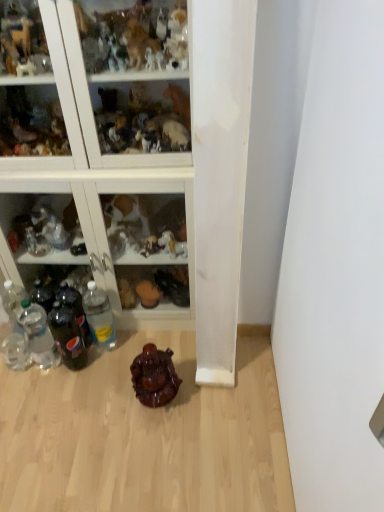
Where is `clear glass bottles at left, the second shelf from the top`? clear glass bottles at left, the second shelf from the top is located at coordinates (102, 215).

Measure the distance between clear plastic bottles at left, the fifth bottle positioned from the right, and camera.

clear plastic bottles at left, the fifth bottle positioned from the right, and camera are 1.62 meters apart.

This screenshot has height=512, width=384. Describe the element at coordinates (16, 347) in the screenshot. I see `clear plastic bottles at left, the fifth bottle positioned from the right` at that location.

What do you see at coordinates (38, 335) in the screenshot? Image resolution: width=384 pixels, height=512 pixels. I see `clear plastic bottles at left, the 4th bottle when ordered from right to left` at bounding box center [38, 335].

I want to click on clear plastic bottles at left, the 4th bottle when ordered from right to left, so click(x=38, y=335).

How much space does clear plastic bottle at lower left, arranged as the first bottle when viewed from the right, occupy horizontally?

2.85 inches.

Based on the photo, what is the approximate width of black plastic bottles at left, which is the 3th bottle from right to left?

black plastic bottles at left, which is the 3th bottle from right to left, is 2.85 inches wide.

Find the location of a particular element. This screenshot has width=384, height=512. translucent glass figurines at upper center, the second shelf positioned from the bottom is located at coordinates (96, 81).

At what (x,y) coordinates should I click in order to perform the action: click on shiny brown statue at center. Please return your answer as a coordinate pair (x, y). The image size is (384, 512). Looking at the image, I should click on (154, 376).

I want to click on clear glass bottles at left, the 1th shelf from the bottom, so click(102, 215).

Can you see translucent glass figurines at upper center, the first shelf positioned from the top, touching clear plastic bottles at left, the 1th bottle from the left?

No, translucent glass figurines at upper center, the first shelf positioned from the top, is not next to clear plastic bottles at left, the 1th bottle from the left.

From a real-world perspective, count 1st bottles downward from the translucent glass figurines at upper center, the second shelf positioned from the bottom, and point to it. Please provide its 2D coordinates.

[(16, 347)]

From the image's perspective, between translucent glass figurines at upper center, the second shelf positioned from the bottom, and clear plastic bottles at left, the 1th bottle from the left, who is located below?

clear plastic bottles at left, the 1th bottle from the left, from the image's perspective.

Considering the relative positions of shiny brown statue at center and clear plastic bottles at left, the fifth bottle positioned from the right, in the image provided, is shiny brown statue at center to the left of clear plastic bottles at left, the fifth bottle positioned from the right, from the viewer's perspective?

In fact, shiny brown statue at center is to the right of clear plastic bottles at left, the fifth bottle positioned from the right.

Could you measure the distance between shiny brown statue at center and clear plastic bottles at left, the fifth bottle positioned from the right?

shiny brown statue at center is 51.84 centimeters from clear plastic bottles at left, the fifth bottle positioned from the right.

Where is `the 2nd bottle above when counting from the shiny brown statue at center (from the image's perspective)`? Image resolution: width=384 pixels, height=512 pixels. the 2nd bottle above when counting from the shiny brown statue at center (from the image's perspective) is located at coordinates (16, 347).

How different are the orientations of shiny brown statue at center and clear plastic bottles at left, the fifth bottle positioned from the right, in degrees?

There is a 10-degree angle between the facing directions of shiny brown statue at center and clear plastic bottles at left, the fifth bottle positioned from the right.

Based on their sizes in the image, would you say clear plastic bottles at left, positioned as the second bottle in left-to-right order, is bigger or smaller than clear plastic bottle at lower left, arranged as the first bottle when viewed from the right?

clear plastic bottles at left, positioned as the second bottle in left-to-right order, is smaller than clear plastic bottle at lower left, arranged as the first bottle when viewed from the right.

From the image's perspective, which one is positioned lower, clear plastic bottles at left, the 4th bottle when ordered from right to left, or clear plastic bottle at lower left, arranged as the first bottle when viewed from the right?

clear plastic bottles at left, the 4th bottle when ordered from right to left, from the image's perspective.

Which is behind, point (29, 315) or point (96, 288)?

The point (29, 315) is more distant.

From a real-world perspective, which object rests below the other?

black plastic bottles at left, the third bottle from the left, is physically lower.

How many degrees apart are the facing directions of dark glass bottle at lower left, which is the 4th bottle in left-to-right order, and black plastic bottles at left, the third bottle from the left?

The angular difference between dark glass bottle at lower left, which is the 4th bottle in left-to-right order, and black plastic bottles at left, the third bottle from the left, is 9.42e-05 degrees.

From the image's perspective, is dark glass bottle at lower left, the second bottle in the right-to-left sequence, beneath black plastic bottles at left, the third bottle from the left?

Yes, from the image's perspective, dark glass bottle at lower left, the second bottle in the right-to-left sequence, is below black plastic bottles at left, the third bottle from the left.

Who is bigger, dark glass bottle at lower left, which is the 4th bottle in left-to-right order, or black plastic bottles at left, the third bottle from the left?

black plastic bottles at left, the third bottle from the left, is bigger.

Is point (24, 20) more distant than point (35, 332)?

No, (24, 20) is closer to viewer.

Is translucent glass figurines at upper center, the first shelf positioned from the top, at the right side of clear plastic bottles at left, positioned as the second bottle in left-to-right order?

Indeed, translucent glass figurines at upper center, the first shelf positioned from the top, is positioned on the right side of clear plastic bottles at left, positioned as the second bottle in left-to-right order.

How many degrees apart are the facing directions of translucent glass figurines at upper center, the second shelf positioned from the bottom, and clear plastic bottles at left, the 4th bottle when ordered from right to left?

The angular difference between translucent glass figurines at upper center, the second shelf positioned from the bottom, and clear plastic bottles at left, the 4th bottle when ordered from right to left, is 0.00306 degrees.

How different are the orientations of clear plastic bottle at lower left, arranged as the first bottle when viewed from the right, and dark glass bottle at lower left, which is the 4th bottle in left-to-right order, in degrees?

The angular difference between clear plastic bottle at lower left, arranged as the first bottle when viewed from the right, and dark glass bottle at lower left, which is the 4th bottle in left-to-right order, is 0.00464 degrees.

Considering the sizes of clear plastic bottle at lower left, the fifth bottle viewed from the left, and dark glass bottle at lower left, which is the 4th bottle in left-to-right order, in the image, is clear plastic bottle at lower left, the fifth bottle viewed from the left, taller or shorter than dark glass bottle at lower left, which is the 4th bottle in left-to-right order,?

In the image, clear plastic bottle at lower left, the fifth bottle viewed from the left, appears to be taller than dark glass bottle at lower left, which is the 4th bottle in left-to-right order.

Between clear plastic bottle at lower left, arranged as the first bottle when viewed from the right, and dark glass bottle at lower left, the second bottle in the right-to-left sequence, which one has larger size?

With larger size is clear plastic bottle at lower left, arranged as the first bottle when viewed from the right.

Which is more to the left, clear plastic bottle at lower left, arranged as the first bottle when viewed from the right, or dark glass bottle at lower left, which is the 4th bottle in left-to-right order?

Positioned to the left is dark glass bottle at lower left, which is the 4th bottle in left-to-right order.

Between clear plastic bottles at left, positioned as the second bottle in left-to-right order, and dark glass bottle at lower left, which is the 4th bottle in left-to-right order, which one has less height?

With less height is dark glass bottle at lower left, which is the 4th bottle in left-to-right order.

Is clear plastic bottles at left, the 4th bottle when ordered from right to left, aimed at dark glass bottle at lower left, the second bottle in the right-to-left sequence?

No, clear plastic bottles at left, the 4th bottle when ordered from right to left, is not turned towards dark glass bottle at lower left, the second bottle in the right-to-left sequence.

Are clear plastic bottles at left, the 4th bottle when ordered from right to left, and dark glass bottle at lower left, the second bottle in the right-to-left sequence, beside each other?

Yes, clear plastic bottles at left, the 4th bottle when ordered from right to left, is with dark glass bottle at lower left, the second bottle in the right-to-left sequence.

How far apart are clear plastic bottles at left, the 4th bottle when ordered from right to left, and dark glass bottle at lower left, the second bottle in the right-to-left sequence?

clear plastic bottles at left, the 4th bottle when ordered from right to left, and dark glass bottle at lower left, the second bottle in the right-to-left sequence, are 3.92 inches apart.

Locate an element on the screen. This screenshot has height=512, width=384. the 2nd shelf directly above the clear plastic bottles at left, the fifth bottle positioned from the right (from a real-world perspective) is located at coordinates (96, 81).

You are a GUI agent. You are given a task and a screenshot of the screen. Output one action in this format:
    pyautogui.click(x=<x>, y=<y>)
    Task: Click on the toy lying in front of the clear plastic bottles at left, the fifth bottle positioned from the right
    Image resolution: width=384 pixels, height=512 pixels.
    Given the screenshot: What is the action you would take?
    point(154,376)

Estimate the real-world distances between objects in this image. Which object is closer to black plastic bottles at left, the third bottle from the left, clear plastic bottles at left, the 4th bottle when ordered from right to left, or clear glass bottles at left, the second shelf from the top?

Among the two, clear plastic bottles at left, the 4th bottle when ordered from right to left, is located nearer to black plastic bottles at left, the third bottle from the left.

Looking at the image, which one is located closer to black plastic bottles at left, which is the 3th bottle from right to left, translucent glass figurines at upper center, the first shelf positioned from the top, or dark glass bottle at lower left, which is the 4th bottle in left-to-right order?

dark glass bottle at lower left, which is the 4th bottle in left-to-right order.

Considering their positions, is clear plastic bottles at left, positioned as the second bottle in left-to-right order, positioned closer to clear plastic bottles at left, the 1th bottle from the left, than translucent glass figurines at upper center, the first shelf positioned from the top?

clear plastic bottles at left, positioned as the second bottle in left-to-right order, lies closer to clear plastic bottles at left, the 1th bottle from the left, than the other object.

Based on the photo, considering their positions, is clear plastic bottle at lower left, arranged as the first bottle when viewed from the right, positioned further to clear plastic bottles at left, the 4th bottle when ordered from right to left, than black plastic bottles at left, the third bottle from the left?

clear plastic bottle at lower left, arranged as the first bottle when viewed from the right.

Considering their positions, is black plastic bottles at left, which is the 3th bottle from right to left, positioned further to clear glass bottles at left, the second shelf from the top, than dark glass bottle at lower left, the second bottle in the right-to-left sequence?

black plastic bottles at left, which is the 3th bottle from right to left.

When comparing their distances from clear plastic bottle at lower left, arranged as the first bottle when viewed from the right, does shiny brown statue at center or translucent glass figurines at upper center, the first shelf positioned from the top, seem closer?

shiny brown statue at center lies closer to clear plastic bottle at lower left, arranged as the first bottle when viewed from the right, than the other object.

Which object lies further to the anchor point translucent glass figurines at upper center, the second shelf positioned from the bottom, clear plastic bottles at left, the fifth bottle positioned from the right, or shiny brown statue at center?

The object further to translucent glass figurines at upper center, the second shelf positioned from the bottom, is clear plastic bottles at left, the fifth bottle positioned from the right.

Based on their spatial positions, is black plastic bottles at left, the third bottle from the left, or clear plastic bottles at left, positioned as the second bottle in left-to-right order, closer to clear plastic bottle at lower left, the fifth bottle viewed from the left?

Based on the image, black plastic bottles at left, the third bottle from the left, appears to be nearer to clear plastic bottle at lower left, the fifth bottle viewed from the left.

Locate an element on the screen. Image resolution: width=384 pixels, height=512 pixels. shelf between translucent glass figurines at upper center, the second shelf positioned from the bottom, and black plastic bottles at left, which is the 3th bottle from right to left, in the up-down direction is located at coordinates (102, 215).

Identify the location of shelf between translucent glass figurines at upper center, the first shelf positioned from the top, and clear plastic bottles at left, the 4th bottle when ordered from right to left, vertically. Image resolution: width=384 pixels, height=512 pixels. (102, 215).

Image resolution: width=384 pixels, height=512 pixels. In order to click on bottle between clear glass bottles at left, the second shelf from the top, and black plastic bottles at left, which is the 3th bottle from right to left, vertically in this screenshot , I will do `click(99, 316)`.

Find the location of a particular element. This screenshot has width=384, height=512. shelf that lies between translucent glass figurines at upper center, the first shelf positioned from the top, and clear plastic bottles at left, the fifth bottle positioned from the right, from top to bottom is located at coordinates (102, 215).